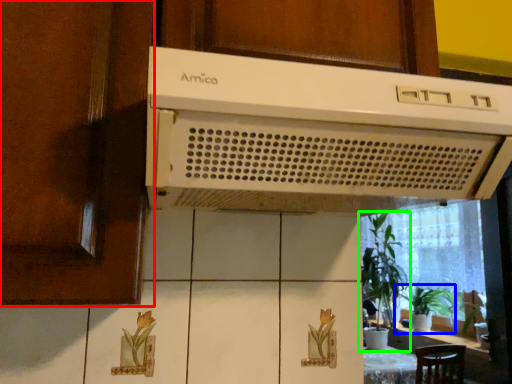
Question: Considering the real-world distances, which object is closest to screen door (highlighted by a red box)? houseplant (highlighted by a blue box) or houseplant (highlighted by a green box).

Choices:
 (A) houseplant
 (B) houseplant

Answer: (B)